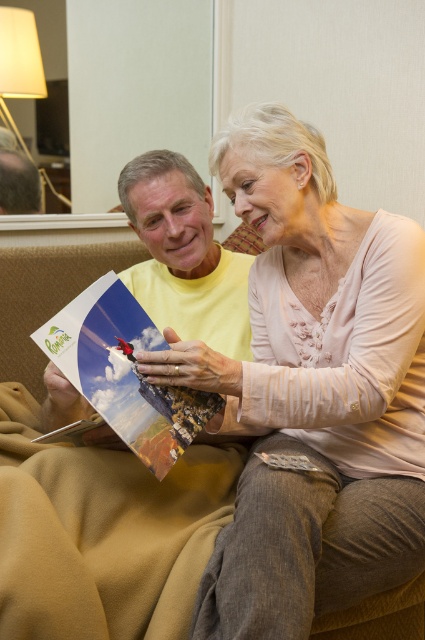
You are a photographer standing in front of the couch. You want to take a photo of the matte paper postcard at center and the matte yellow shirt at upper center. Which object should you focus on first to ensure both are in focus?

The matte paper postcard at center is closer to the viewer than the matte yellow shirt at upper center. To ensure both are in focus, focus on the matte paper postcard at center first since it is the closer object.